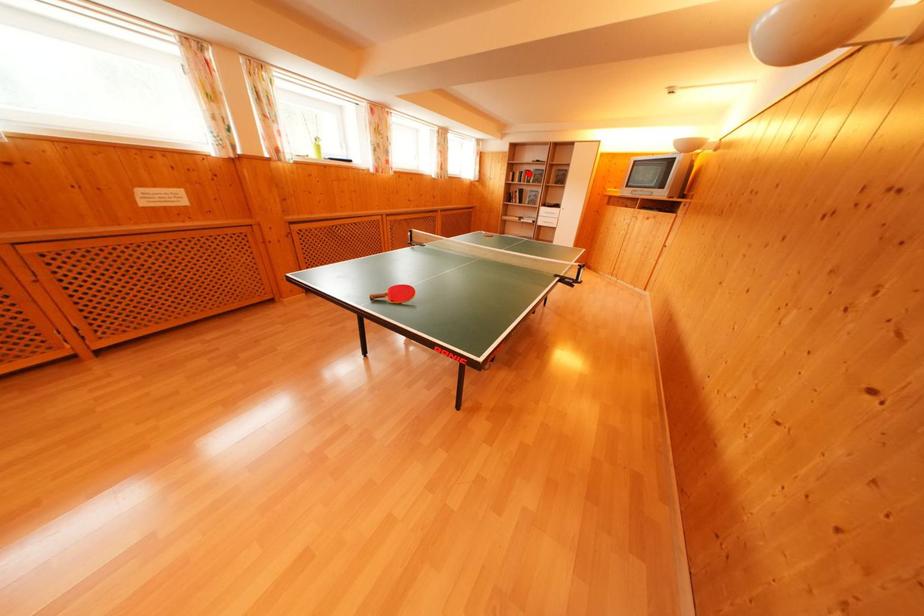
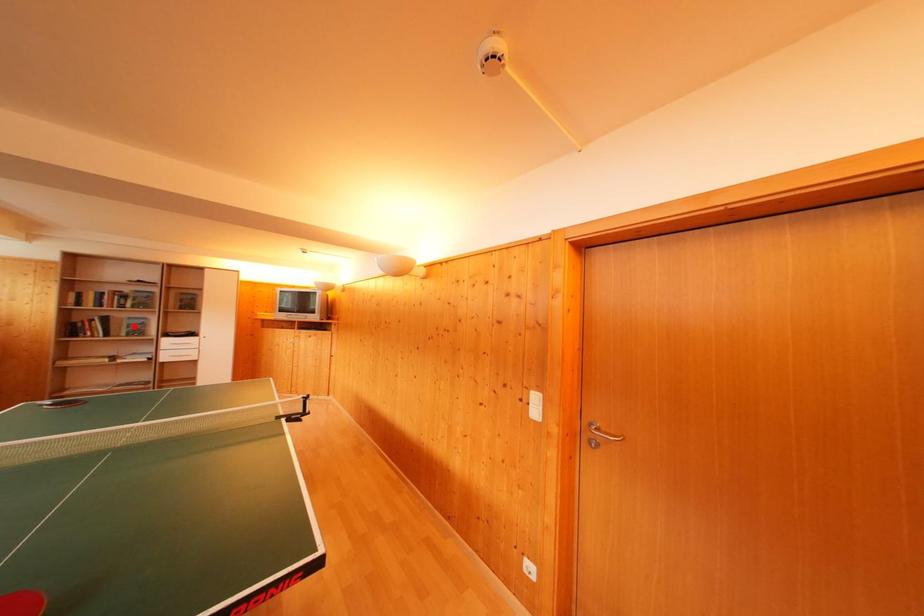
I am providing you with two images of the same scene from different viewpoints. A red point is marked on the first image and another point is marked on the second image. Are the points marked in image1 and image2 representing the same 3D position?

No